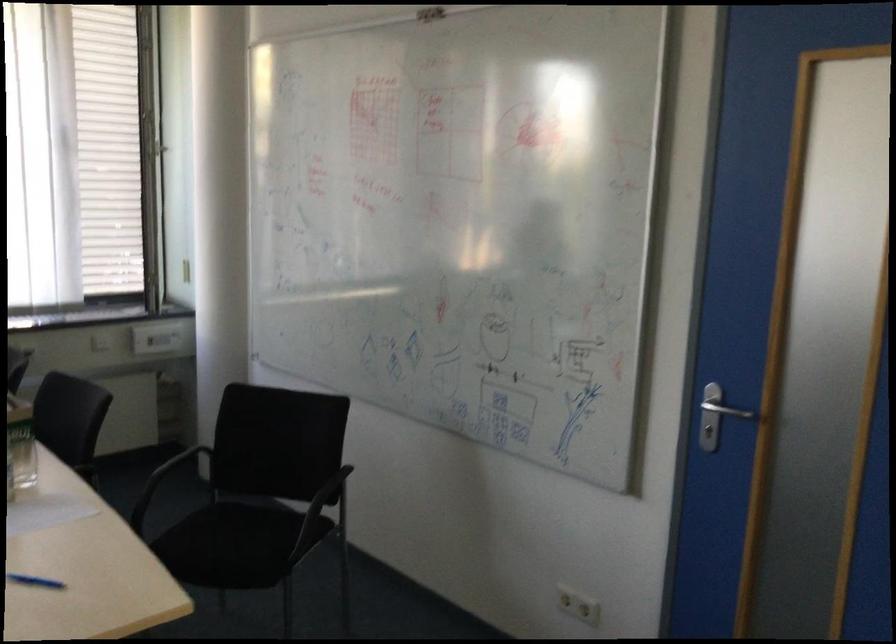
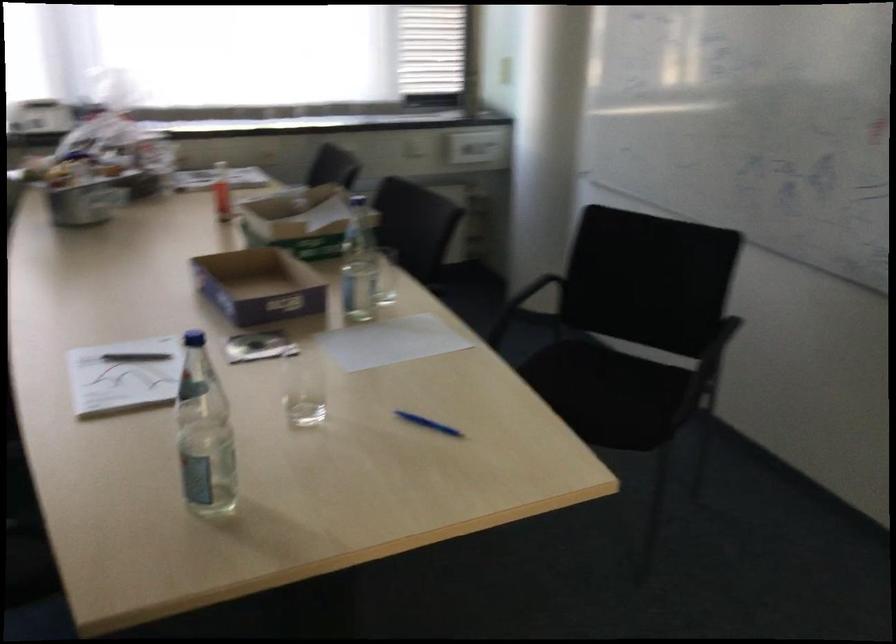
What movement of the cameraman would produce the second image?

The cameraman moved toward left, forward.